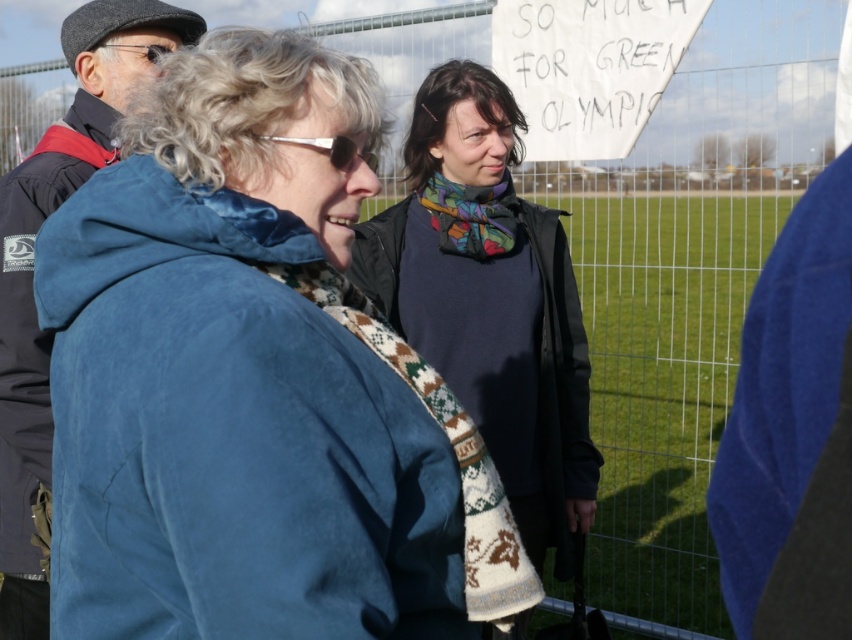
You are organizing a clothing donation drive and need to determine which item takes up more space in the donation bin. Based on the image, which item is larger in size between the dark blue sweater at center and the velvet blue jacket at left?

The velvet blue jacket at left is larger than the dark blue sweater at center, so it takes up more space in the donation bin.

You are trying to decide which clothing item to choose for a casual day out. Based on the image, which of the two items, the blue suede jacket at center or the dark blue sweater at center, is shorter in length?

The blue suede jacket at center is shorter than the dark blue sweater at center, so if you prefer a shorter length, the blue suede jacket at center would be the better choice.